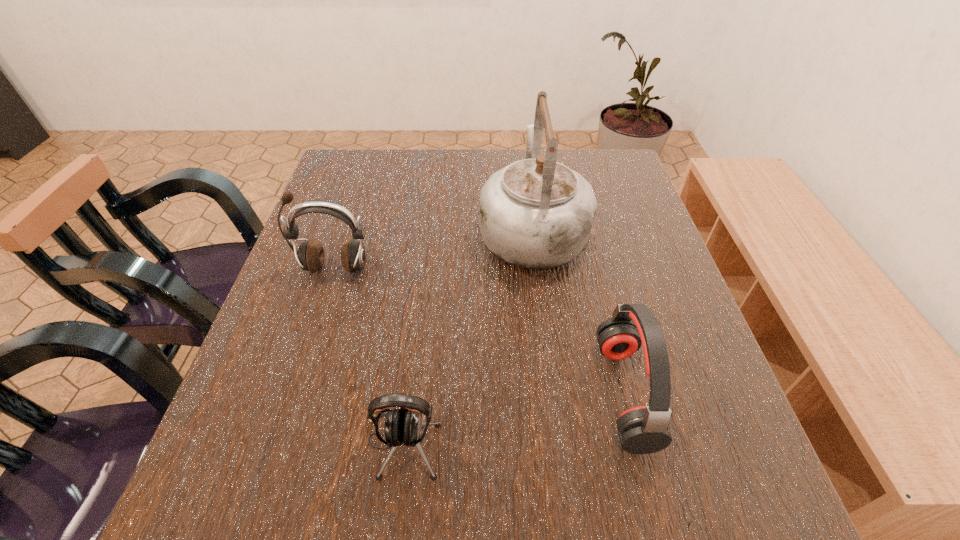
In the image, there is a desktop. Where is `free region at the right edge`? free region at the right edge is located at coordinates (684, 379).

The image size is (960, 540). In the image, there is a desktop. What are the coordinates of `blank space at the far left corner` in the screenshot? It's located at (369, 161).

What are the coordinates of `vacant space at the far right corner of the desktop` in the screenshot? It's located at (586, 167).

The image size is (960, 540). Identify the location of vacant area at the near right corner of the desktop. (756, 479).

The width and height of the screenshot is (960, 540). In order to click on vacant area between the rightmost earphone and the farthest earphone in this screenshot , I will do `click(479, 330)`.

Identify the location of free spot between the third object from right to left and the rightmost earphone. The width and height of the screenshot is (960, 540). (514, 418).

Locate an element on the screen. vacant point located between the tallest object and the rightmost earphone is located at coordinates (578, 311).

Locate an element on the screen. Image resolution: width=960 pixels, height=540 pixels. free space between the farthest earphone and the kettle is located at coordinates (433, 248).

Identify the location of vacant point located between the second earphone from right to left and the leftmost object. The width and height of the screenshot is (960, 540). (369, 355).

Where is `free space between the farthest earphone and the third object from right to left`? The width and height of the screenshot is (960, 540). free space between the farthest earphone and the third object from right to left is located at coordinates (369, 355).